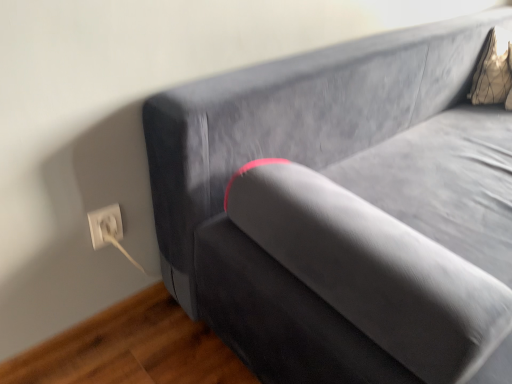
Question: In terms of size, does white plastic electric outlet at lower left appear bigger or smaller than gold textured pillow at upper right?

Choices:
 (A) big
 (B) small

Answer: (B)

Question: Is point (109, 218) positioned closer to the camera than point (501, 62)?

Choices:
 (A) farther
 (B) closer

Answer: (B)

Question: From a real-world perspective, is white plastic electric outlet at lower left positioned above or below gold textured pillow at upper right?

Choices:
 (A) below
 (B) above

Answer: (A)

Question: From a real-world perspective, is gold textured pillow at upper right above or below white plastic electric outlet at lower left?

Choices:
 (A) below
 (B) above

Answer: (B)

Question: In terms of width, does gold textured pillow at upper right look wider or thinner when compared to white plastic electric outlet at lower left?

Choices:
 (A) thin
 (B) wide

Answer: (B)

Question: Is gold textured pillow at upper right situated inside white plastic electric outlet at lower left or outside?

Choices:
 (A) outside
 (B) inside

Answer: (A)

Question: Based on their sizes in the image, would you say gold textured pillow at upper right is bigger or smaller than white plastic electric outlet at lower left?

Choices:
 (A) big
 (B) small

Answer: (A)